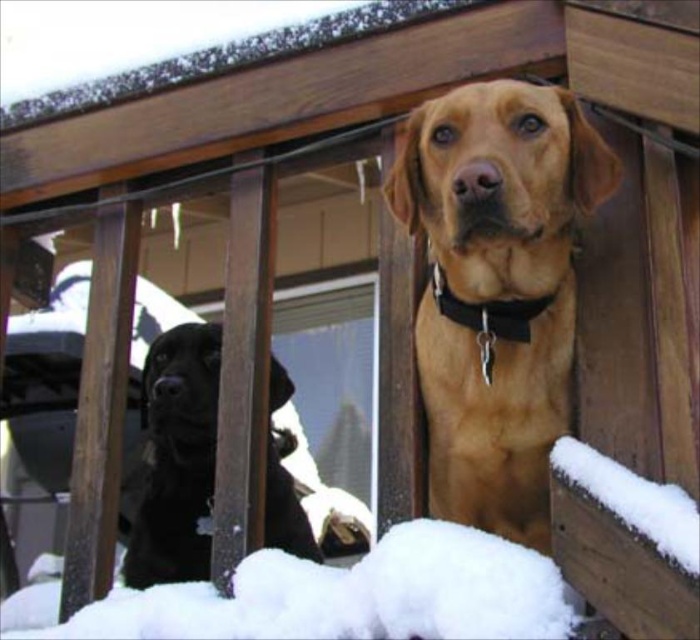
Question: Can you confirm if white fluffy snow at lower center is bigger than shiny black dog at left?

Choices:
 (A) yes
 (B) no

Answer: (B)

Question: Can you confirm if white fluffy snow at lower center is positioned below shiny black dog at left?

Choices:
 (A) no
 (B) yes

Answer: (B)

Question: Considering the relative positions of golden fur dog at center and shiny black dog at left in the image provided, where is golden fur dog at center located with respect to shiny black dog at left?

Choices:
 (A) below
 (B) above

Answer: (B)

Question: Which of these objects is positioned closest to the shiny black dog at left?

Choices:
 (A) golden fur dog at center
 (B) black matte neckband at center

Answer: (A)

Question: Which of the following is the closest to the observer?

Choices:
 (A) white fluffy snow at lower center
 (B) black matte neckband at center

Answer: (A)

Question: Among these objects, which one is farthest from the camera?

Choices:
 (A) golden fur dog at center
 (B) white fluffy snow at lower center
 (C) black matte neckband at center
 (D) shiny black dog at left

Answer: (D)